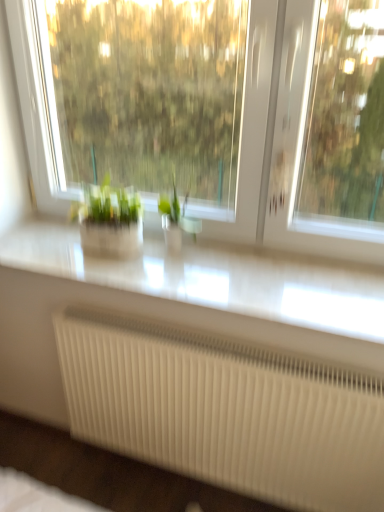
Question: Does white ribbed radiator at lower center have a lesser width compared to green matte plant at center?

Choices:
 (A) yes
 (B) no

Answer: (B)

Question: Can you confirm if white ribbed radiator at lower center is taller than green matte plant at center?

Choices:
 (A) yes
 (B) no

Answer: (A)

Question: From the image's perspective, is white ribbed radiator at lower center under green matte plant at center?

Choices:
 (A) yes
 (B) no

Answer: (A)

Question: Considering the relative sizes of white ribbed radiator at lower center and green matte plant at center in the image provided, is white ribbed radiator at lower center smaller than green matte plant at center?

Choices:
 (A) no
 (B) yes

Answer: (A)

Question: Is white ribbed radiator at lower center in front of green matte plant at center?

Choices:
 (A) yes
 (B) no

Answer: (A)

Question: Considering the positions of point (266, 167) and point (311, 437), is point (266, 167) closer or farther from the camera than point (311, 437)?

Choices:
 (A) closer
 (B) farther

Answer: (B)

Question: From a real-world perspective, is transparent glass window at center physically located above or below white ribbed radiator at lower center?

Choices:
 (A) above
 (B) below

Answer: (A)

Question: In terms of height, does transparent glass window at center look taller or shorter compared to white ribbed radiator at lower center?

Choices:
 (A) short
 (B) tall

Answer: (B)

Question: Considering the positions of transparent glass window at center and white ribbed radiator at lower center in the image, is transparent glass window at center bigger or smaller than white ribbed radiator at lower center?

Choices:
 (A) small
 (B) big

Answer: (B)

Question: From a real-world perspective, is white glossy counter top at center above or below transparent glass window at center?

Choices:
 (A) below
 (B) above

Answer: (A)

Question: Is white glossy counter top at center to the left or to the right of transparent glass window at center in the image?

Choices:
 (A) left
 (B) right

Answer: (A)

Question: Is point (137, 282) positioned closer to the camera than point (115, 139)?

Choices:
 (A) farther
 (B) closer

Answer: (B)

Question: Choose the correct answer: Is white glossy counter top at center inside transparent glass window at center or outside it?

Choices:
 (A) outside
 (B) inside

Answer: (A)

Question: Relative to white ribbed radiator at lower center, is green matte plant at center in front or behind?

Choices:
 (A) behind
 (B) front

Answer: (A)

Question: From a real-world perspective, is green matte plant at center physically located above or below white ribbed radiator at lower center?

Choices:
 (A) below
 (B) above

Answer: (B)